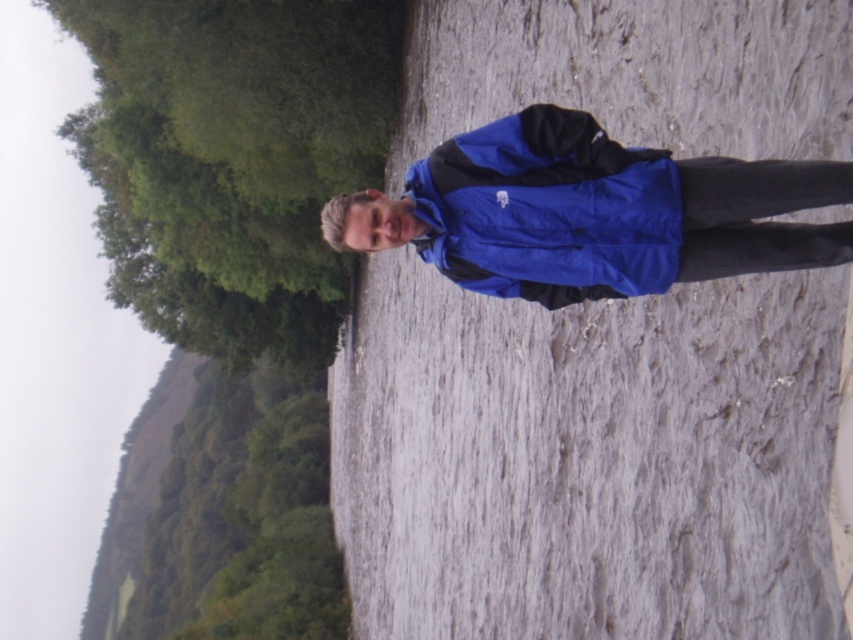
You are a photographer trying to capture the person in the image. Which jacket, the blue fabric jacket at center or the blue synthetic jacket at center, will appear larger in your photo?

The blue fabric jacket at center will appear larger in the photo because it is closer to the viewer than the blue synthetic jacket at center.